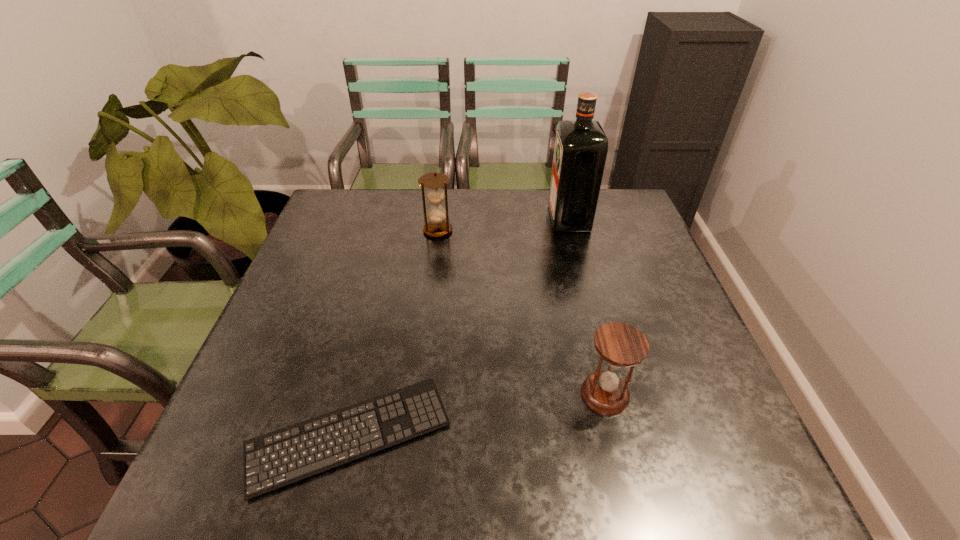
Where is `unoccupied area between the shortest object and the left hourglass`? This screenshot has height=540, width=960. unoccupied area between the shortest object and the left hourglass is located at coordinates (394, 333).

At what (x,y) coordinates should I click in order to perform the action: click on free space between the liquor and the left hourglass. Please return your answer as a coordinate pair (x, y). Looking at the image, I should click on (503, 225).

Locate an element on the screen. This screenshot has width=960, height=540. object that stands as the second closest to the left hourglass is located at coordinates (273, 460).

Select which object appears as the third closest to the farther hourglass. Please provide its 2D coordinates. Your answer should be formatted as a tuple, i.e. [(x, y)], where the tuple contains the x and y coordinates of a point satisfying the conditions above.

[(621, 345)]

The height and width of the screenshot is (540, 960). I want to click on blank space that satisfies the following two spatial constraints: 1. on the back side of the computer keyboard; 2. on the left side of the nearer hourglass, so click(x=359, y=394).

This screenshot has width=960, height=540. In order to click on vacant position in the image that satisfies the following two spatial constraints: 1. on the front label of the liquor; 2. on the front side of the computer keyboard in this screenshot , I will do `click(626, 435)`.